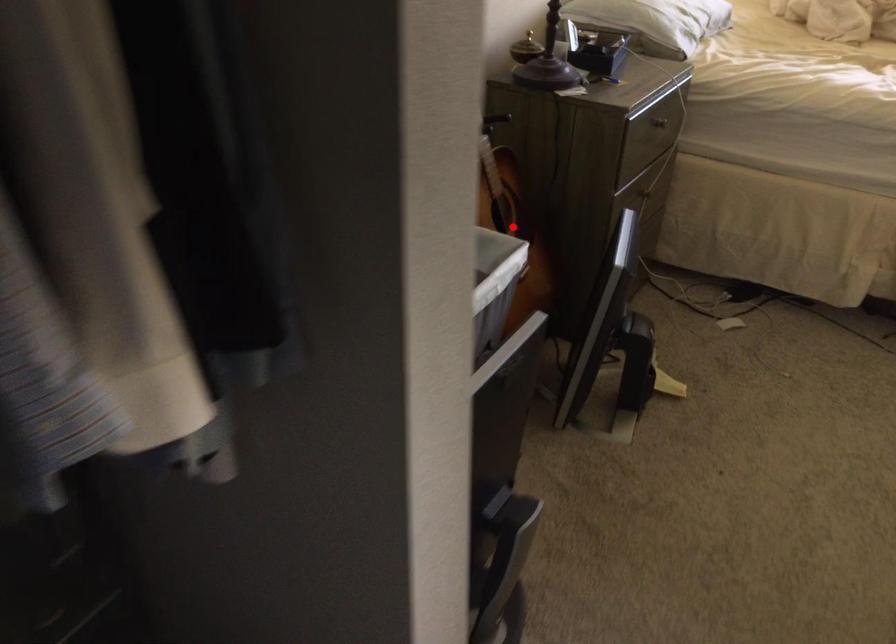
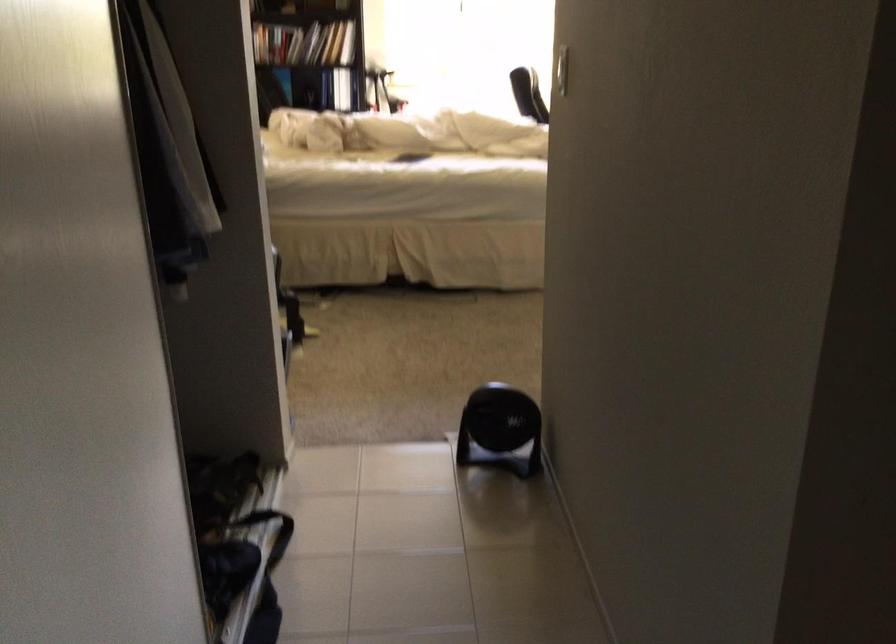
Question: I am providing you with two images of the same scene from different viewpoints. A red point is marked on the first image. Is the red point's position out of view in image 2?

Choices:
 (A) Yes
 (B) No

Answer: (A)